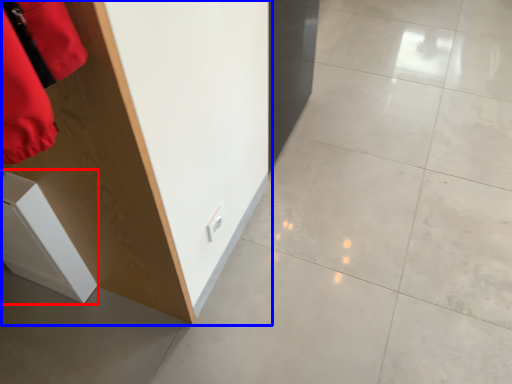
Question: Which point is closer to the camera, cabinetry (highlighted by a red box) or furniture (highlighted by a blue box)?

Choices:
 (A) cabinetry
 (B) furniture

Answer: (B)